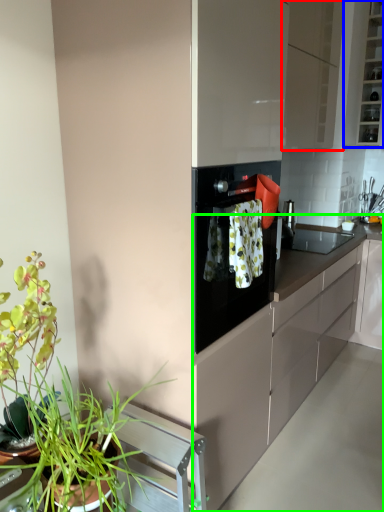
Question: Which object is the farthest from cabinetry (highlighted by a red box)? Choose among these: cabinetry (highlighted by a blue box) or countertop (highlighted by a green box).

Choices:
 (A) cabinetry
 (B) countertop

Answer: (B)